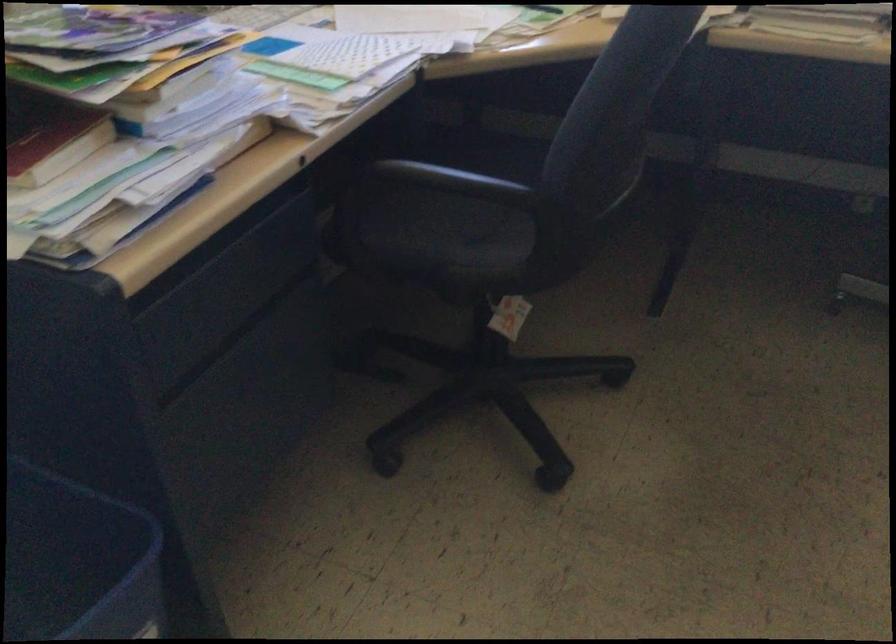
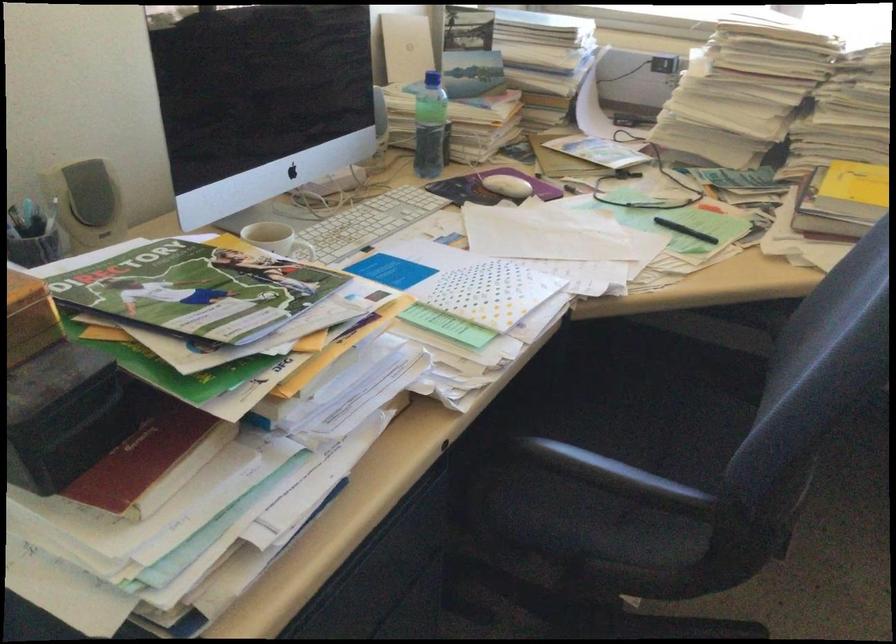
In the second image, find the point that corresponds to (x=520, y=167) in the first image.

(653, 411)